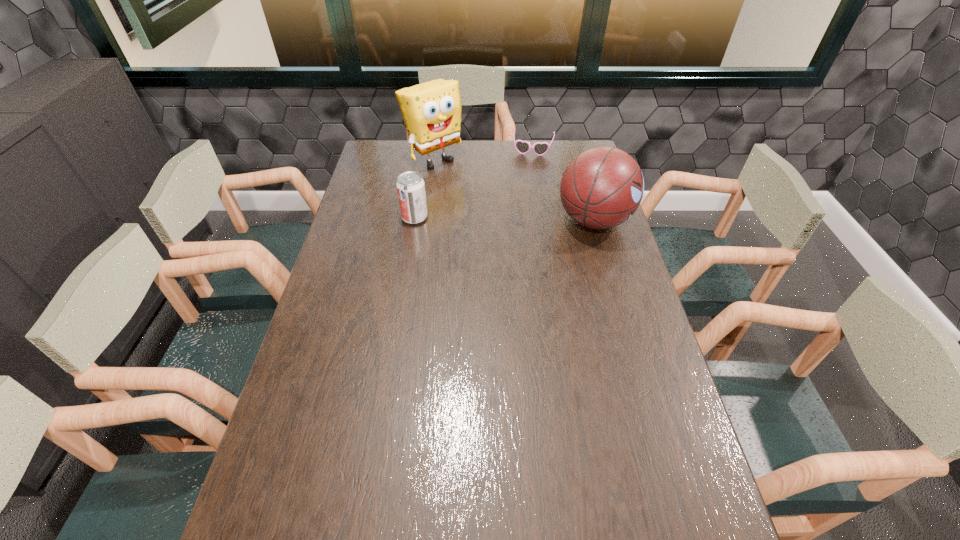
Image resolution: width=960 pixels, height=540 pixels. Identify the location of the third tallest object. (410, 186).

This screenshot has height=540, width=960. Find the location of `the second tallest object`. the second tallest object is located at coordinates pos(601,188).

You are a GUI agent. You are given a task and a screenshot of the screen. Output one action in this format:
    pyautogui.click(x=<x>, y=<y>)
    Task: Click on the sponge
    Image resolution: width=960 pixels, height=540 pixels.
    Given the screenshot: What is the action you would take?
    click(431, 111)

This screenshot has width=960, height=540. What are the coordinates of `sunglasses` in the screenshot? It's located at pyautogui.click(x=523, y=147).

The width and height of the screenshot is (960, 540). In order to click on free space located on the right of the third tallest object in this screenshot , I will do `click(502, 217)`.

At what (x,y) coordinates should I click in order to perform the action: click on blank space located 0.300m on the back of the third shortest object. Please return your answer as a coordinate pair (x, y). Looking at the image, I should click on (575, 154).

Find the location of a particular element. vacant space located 0.290m on the face of the tallest object is located at coordinates (495, 207).

Where is `free space located on the face of the tallest object`? The width and height of the screenshot is (960, 540). free space located on the face of the tallest object is located at coordinates (464, 181).

The image size is (960, 540). I want to click on vacant space located on the face of the tallest object, so click(464, 181).

Locate an element on the screen. This screenshot has height=540, width=960. free space located on the front-facing side of the shortest object is located at coordinates (521, 211).